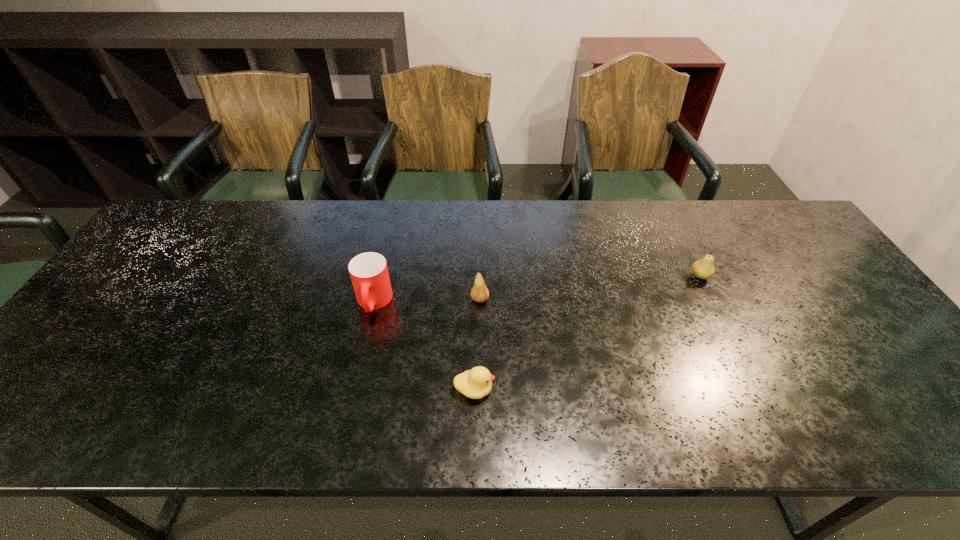
Identify the location of vacant position located on the beak of the shortest object. The height and width of the screenshot is (540, 960). (575, 390).

The image size is (960, 540). I want to click on object located at the near edge, so click(476, 383).

Identify the location of free space at the far edge of the desktop. This screenshot has width=960, height=540. click(588, 208).

This screenshot has width=960, height=540. I want to click on vacant space at the left edge, so click(x=98, y=383).

In order to click on free location at the right edge in this screenshot , I will do `click(827, 332)`.

You are a GUI agent. You are given a task and a screenshot of the screen. Output one action in this format:
    pyautogui.click(x=<x>, y=<y>)
    Task: Click on the vacant space at the far right corner
    The image size is (960, 540).
    Given the screenshot: What is the action you would take?
    pyautogui.click(x=757, y=230)

Find the location of a particular element. This screenshot has height=540, width=960. free space between the cup and the nearer pear is located at coordinates (427, 301).

Locate an element on the screen. free space between the shortest object and the nearer pear is located at coordinates (477, 345).

I want to click on empty space that is in between the nearer pear and the shortest object, so click(477, 345).

At what (x,y) coordinates should I click in order to perform the action: click on free space between the nearer pear and the leftmost object. Please return your answer as a coordinate pair (x, y). This screenshot has width=960, height=540. Looking at the image, I should click on (427, 301).